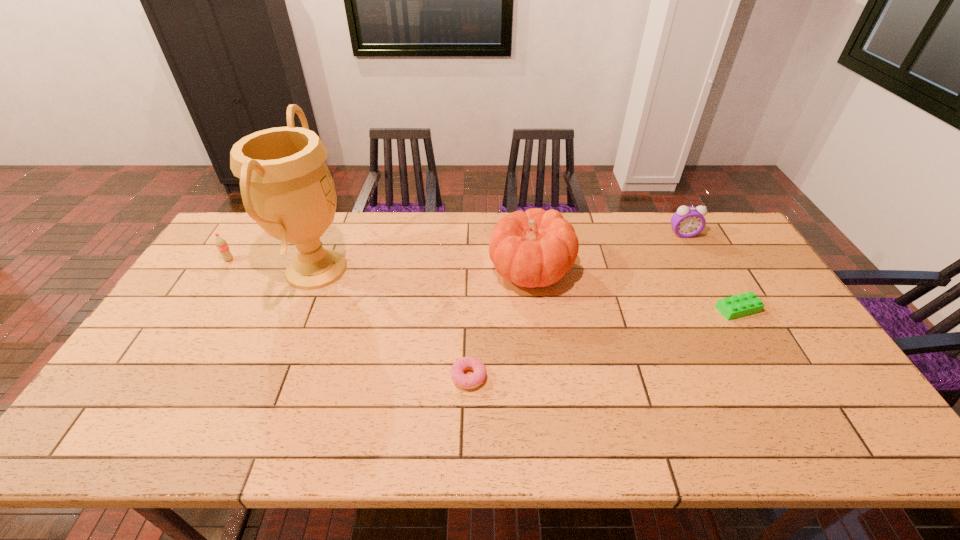
Identify the location of free spot between the Lego and the leftmost object. Image resolution: width=960 pixels, height=540 pixels. (484, 285).

Image resolution: width=960 pixels, height=540 pixels. Identify the location of empty location between the third object from left to right and the fifth shortest object. (499, 323).

Find the location of a particular element. Image resolution: width=960 pixels, height=540 pixels. vacant region between the soda and the shortest object is located at coordinates (348, 318).

Identify the location of free space that is in between the soda and the Lego. This screenshot has width=960, height=540. (484, 285).

Where is `vacant space that is in between the soda and the shortest object`? The image size is (960, 540). vacant space that is in between the soda and the shortest object is located at coordinates (348, 318).

Find the location of a particular element. unoccupied area between the fifth shortest object and the soda is located at coordinates (380, 265).

This screenshot has width=960, height=540. What are the coordinates of `free spot between the tallest object and the nearest object` in the screenshot? It's located at (393, 323).

Identify the location of vacant region between the second object from left to right and the soda. The width and height of the screenshot is (960, 540). (273, 265).

This screenshot has width=960, height=540. What are the coordinates of `object that is the second closest one to the third object from right to left` in the screenshot? It's located at (687, 222).

Identify which object is the fourth closest to the alarm clock. Please provide its 2D coordinates. Your answer should be formatted as a tuple, i.e. [(x, y)], where the tuple contains the x and y coordinates of a point satisfying the conditions above.

[(286, 187)]